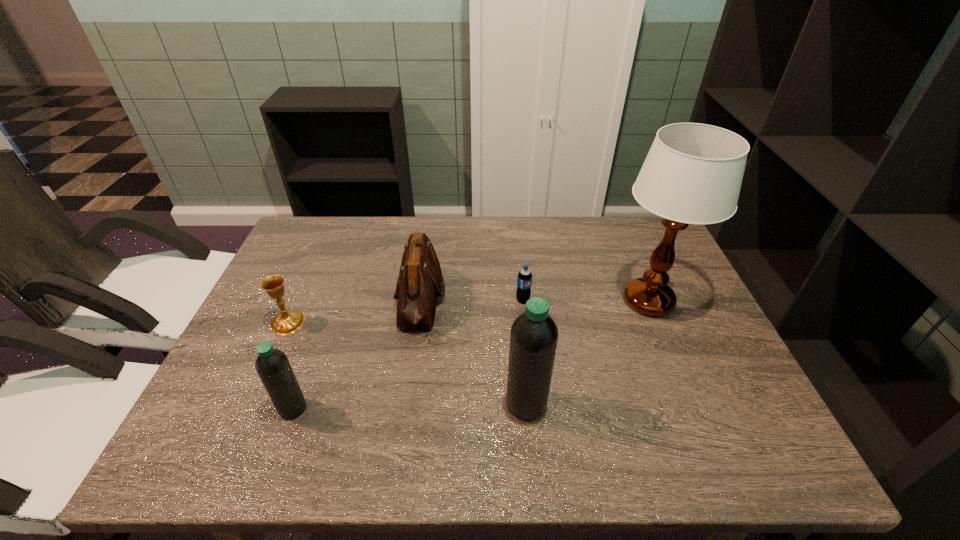
This screenshot has width=960, height=540. I want to click on free space at the far right corner of the desktop, so click(x=640, y=247).

Where is `vacant position at the near right corner of the desktop`? This screenshot has width=960, height=540. vacant position at the near right corner of the desktop is located at coordinates (679, 395).

At what (x,y) coordinates should I click in order to perform the action: click on empty space that is in between the shoulder bag and the shorter water bottle. Please return your answer as a coordinate pair (x, y). The height and width of the screenshot is (540, 960). Looking at the image, I should click on (357, 353).

Find the location of `free area in between the leftmost object and the table lamp`. free area in between the leftmost object and the table lamp is located at coordinates (468, 312).

This screenshot has height=540, width=960. I want to click on blank region between the rightmost object and the left water bottle, so click(470, 355).

You are a GUI agent. You are given a task and a screenshot of the screen. Output one action in this format:
    pyautogui.click(x=<x>, y=<y>)
    Task: Click on the vacant area that lies between the tallest object and the fifth shortest object
    The width and height of the screenshot is (960, 540).
    Given the screenshot: What is the action you would take?
    pyautogui.click(x=588, y=353)

This screenshot has height=540, width=960. What are the coordinates of `vacant space in between the left water bottle and the second tallest object` in the screenshot? It's located at (410, 406).

At what (x,y) coordinates should I click in order to perform the action: click on vacant area that lies between the tallest object and the shorter water bottle. Please return your answer as a coordinate pair (x, y). This screenshot has width=960, height=540. Looking at the image, I should click on (470, 355).

At what (x,y) coordinates should I click in order to perform the action: click on vacant space that is in between the soda bottle and the tallest object. Please return your answer as a coordinate pair (x, y). Looking at the image, I should click on (586, 300).

The width and height of the screenshot is (960, 540). I want to click on vacant area between the tallest object and the taller water bottle, so click(x=588, y=353).